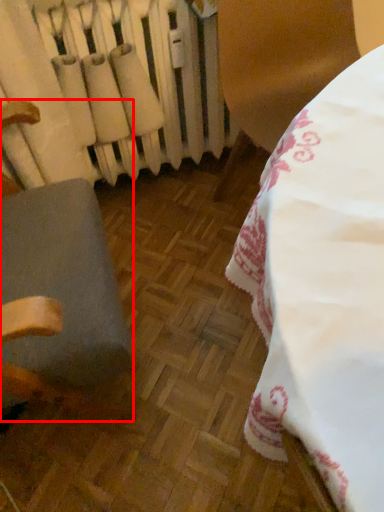
Question: From the image's perspective, what is the correct spatial relationship of furniture (annotated by the red box) in relation to radiator?

Choices:
 (A) above
 (B) below

Answer: (B)